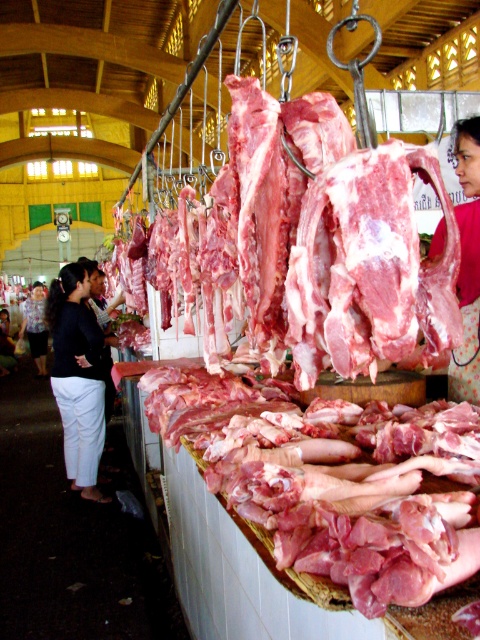
You are a customer at the market and want to buy both the black cotton pants at lower left and the matte pink fabric at center. Which item is closer to the ground?

The black cotton pants at lower left is below matte pink fabric at center, so the black cotton pants at lower left is closer to the ground.

You are a customer at the market and want to compare the heights of the black cotton pants at lower left and the matte pink fabric at center. Which one is taller?

The black cotton pants at lower left has a greater height compared to the matte pink fabric at center.